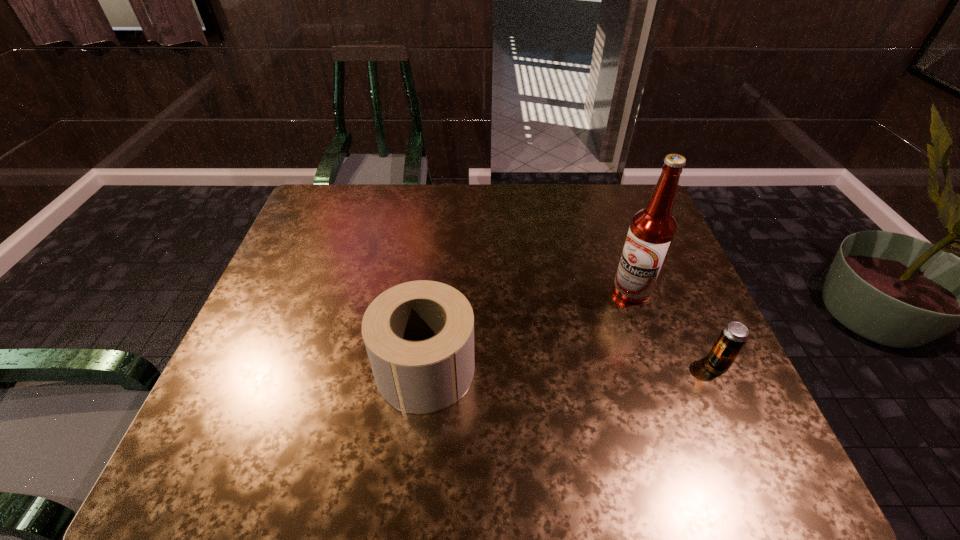
At what (x,y) coordinates should I click in order to perform the action: click on free space on the desktop that is between the toilet tissue and the beer can and is positioned on the label side of the alcohol. Please return your answer as a coordinate pair (x, y). Looking at the image, I should click on (590, 366).